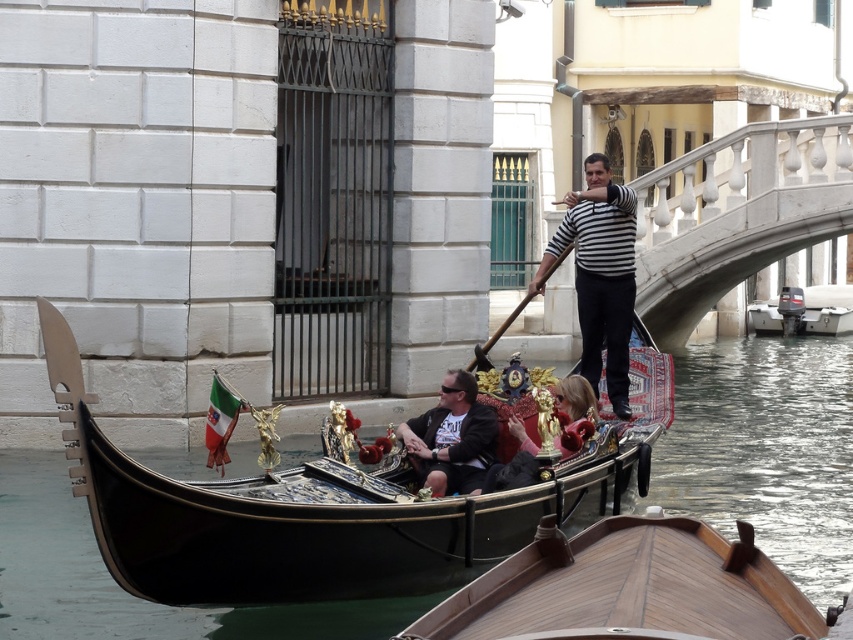
Question: Which of these objects is positioned farthest from the wooden polished boat at center?

Choices:
 (A) black polished wood gondola at center
 (B) matte black jacket at center

Answer: (B)

Question: Can you confirm if wooden polished boat at center is wider than striped fabric man at center?

Choices:
 (A) no
 (B) yes

Answer: (B)

Question: Which point is closer to the camera?

Choices:
 (A) (703, 552)
 (B) (630, 321)

Answer: (A)

Question: Does wooden polished boat at center lie behind striped fabric man at center?

Choices:
 (A) yes
 (B) no

Answer: (B)

Question: Which point is closer to the camera?

Choices:
 (A) white plastic motorboat at right
 (B) striped fabric man at center

Answer: (B)

Question: Is wooden polished boat at center above striped fabric man at center?

Choices:
 (A) yes
 (B) no

Answer: (B)